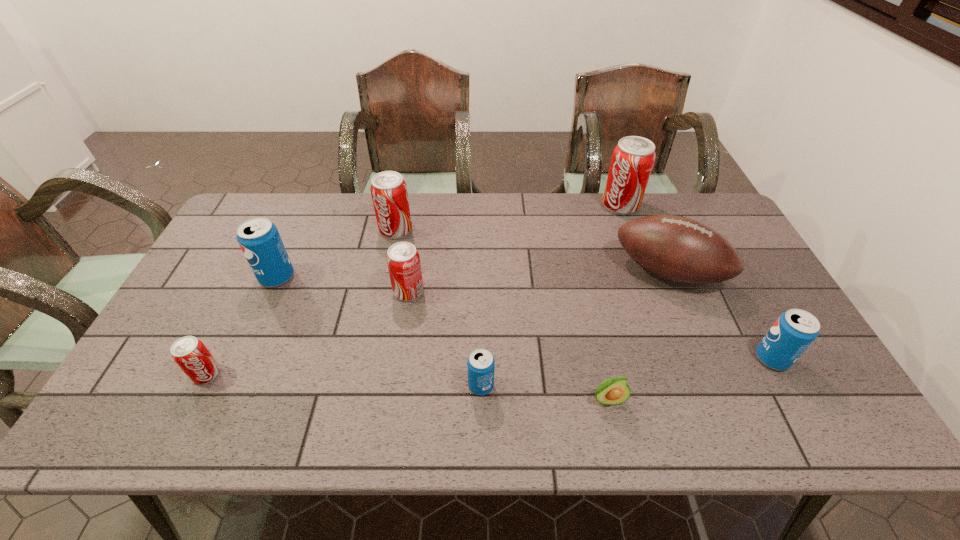
This screenshot has width=960, height=540. In order to click on free space at the left edge of the desktop in this screenshot , I will do `click(228, 260)`.

In the image, there is a desktop. Where is `vacant space at the far right corner`? vacant space at the far right corner is located at coordinates (716, 226).

The image size is (960, 540). Identify the location of free point between the rightmost soda can and the fifth object from left to right. click(x=627, y=372).

You are a GUI agent. You are given a task and a screenshot of the screen. Output one action in this format:
    pyautogui.click(x=<x>, y=<y>)
    Task: Click on the free spot between the second blue soda can from right to left and the nearest red soda can
    This screenshot has width=960, height=540.
    Given the screenshot: What is the action you would take?
    pyautogui.click(x=344, y=380)

Locate an element on the screen. vacant space in between the green avocado and the third biggest red soda can is located at coordinates (508, 346).

The height and width of the screenshot is (540, 960). In order to click on vacant region between the smallest blue soda can and the green avocado in this screenshot , I will do `click(544, 393)`.

The height and width of the screenshot is (540, 960). Find the location of `vacant area that lies between the second biggest blue soda can and the third farthest red soda can`. vacant area that lies between the second biggest blue soda can and the third farthest red soda can is located at coordinates [590, 325].

At what (x,y) coordinates should I click in order to perform the action: click on free spot between the second farthest soda can and the biggest red soda can. Please return your answer as a coordinate pair (x, y). This screenshot has height=540, width=960. Looking at the image, I should click on (508, 218).

Where is `vacant space that is in between the third farthest red soda can and the smallest red soda can`? vacant space that is in between the third farthest red soda can and the smallest red soda can is located at coordinates (307, 333).

Identify the location of vacant area that lies between the avocado and the second blue soda can from left to right. This screenshot has height=540, width=960. (544, 393).